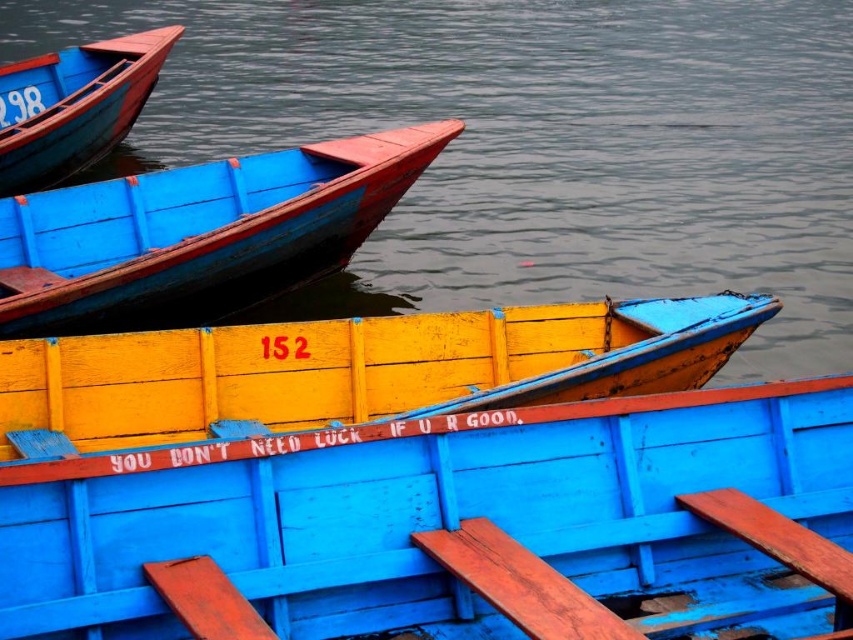
Question: Which of these objects is positioned closest to the matte blue wooden boat at upper left?

Choices:
 (A) matte blue boat at upper left
 (B) smooth water at boat center
 (C) matte blue wooden boat at center

Answer: (A)

Question: Estimate the real-world distances between objects in this image. Which object is closer to the wooden canoe at center?

Choices:
 (A) matte blue wooden boat at upper left
 (B) matte blue wooden boat at center
 (C) matte blue boat at upper left
 (D) smooth water at boat center

Answer: (B)

Question: Is wooden canoe at center below matte blue wooden boat at upper left?

Choices:
 (A) yes
 (B) no

Answer: (A)

Question: Does wooden canoe at center lie in front of matte blue boat at upper left?

Choices:
 (A) no
 (B) yes

Answer: (B)

Question: Which of the following is the farthest from the observer?

Choices:
 (A) wooden canoe at center
 (B) matte blue wooden boat at center
 (C) matte blue wooden boat at upper left

Answer: (C)

Question: Is smooth water at boat center to the left of matte blue wooden boat at center from the viewer's perspective?

Choices:
 (A) yes
 (B) no

Answer: (A)